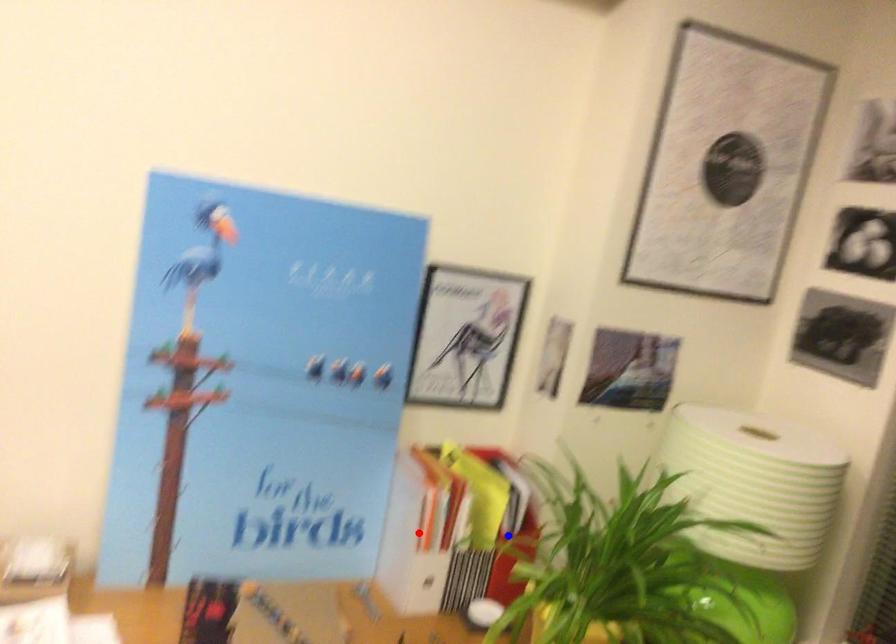
Question: Which of the two points in the image is closer to the camera?

Choices:
 (A) Blue point is closer.
 (B) Red point is closer.

Answer: (B)